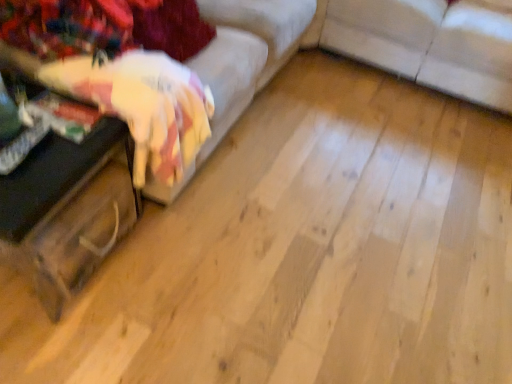
In the scene shown: Measure the distance between point [120,150] and camera.

4.51 feet.

Measure the distance between velvet fabric couch at left, positioned as the first studio couch in left-to-right order, and camera.

velvet fabric couch at left, positioned as the first studio couch in left-to-right order, and camera are 4.26 feet apart.

Where is `white fabric couch at center, placed as the first studio couch when sorted from right to left`? white fabric couch at center, placed as the first studio couch when sorted from right to left is located at coordinates (429, 44).

Is velvet fabric couch at left, positioned as the first studio couch in left-to-right order, turned away from wooden trunk at left?

That's not correct — velvet fabric couch at left, positioned as the first studio couch in left-to-right order, is not looking away from wooden trunk at left.

Is point (249, 36) closer or farther from the camera than point (52, 191)?

Point (249, 36) is farther from the camera than point (52, 191).

From the image's perspective, which is below, velvet fabric couch at left, positioned as the first studio couch in left-to-right order, or wooden trunk at left?

wooden trunk at left appears lower in the image.

From a real-world perspective, who is located higher, white fabric couch at center, placed as the first studio couch when sorted from right to left, or velvet fabric couch at left, which is counted as the second studio couch, starting from the right?

In real-world perspective, velvet fabric couch at left, which is counted as the second studio couch, starting from the right, is above.

Is point (414, 74) positioned in front of point (195, 99)?

That is False.

What's the angular difference between white fabric couch at center, placed as the first studio couch when sorted from right to left, and velvet fabric couch at left, positioned as the first studio couch in left-to-right order,'s facing directions?

The angle between the facing direction of white fabric couch at center, placed as the first studio couch when sorted from right to left, and the facing direction of velvet fabric couch at left, positioned as the first studio couch in left-to-right order, is 90.3 degrees.

Image resolution: width=512 pixels, height=384 pixels. Identify the location of studio couch below the white fabric couch at center, positioned as the 2th studio couch in left-to-right order (from the image's perspective). (182, 83).

Locate an element on the screen. The image size is (512, 384). table behind the velvet fabric couch at left, positioned as the first studio couch in left-to-right order is located at coordinates (67, 210).

Does wooden trunk at left have a greater height compared to velvet fabric couch at left, which is counted as the second studio couch, starting from the right?

Incorrect, the height of wooden trunk at left is not larger of that of velvet fabric couch at left, which is counted as the second studio couch, starting from the right.

Considering the points (132, 194) and (241, 66), which point is in front, point (132, 194) or point (241, 66)?

The point (132, 194) is closer to the camera.

Is wooden trunk at left inside the boundaries of velvet fabric couch at left, positioned as the first studio couch in left-to-right order, or outside?

wooden trunk at left exists outside the volume of velvet fabric couch at left, positioned as the first studio couch in left-to-right order.

Locate an element on the screen. Image resolution: width=512 pixels, height=384 pixels. studio couch on the right of velvet fabric couch at left, which is counted as the second studio couch, starting from the right is located at coordinates (429, 44).

In terms of height, does velvet fabric couch at left, which is counted as the second studio couch, starting from the right, look taller or shorter compared to white fabric couch at center, positioned as the 2th studio couch in left-to-right order?

Considering their sizes, velvet fabric couch at left, which is counted as the second studio couch, starting from the right, has more height than white fabric couch at center, positioned as the 2th studio couch in left-to-right order.

Are velvet fabric couch at left, positioned as the first studio couch in left-to-right order, and white fabric couch at center, positioned as the 2th studio couch in left-to-right order, far apart?

No, velvet fabric couch at left, positioned as the first studio couch in left-to-right order, is not far from white fabric couch at center, positioned as the 2th studio couch in left-to-right order.

From the image's perspective, is velvet fabric couch at left, positioned as the first studio couch in left-to-right order, positioned above or below white fabric couch at center, placed as the first studio couch when sorted from right to left?

Clearly, from the image's perspective, velvet fabric couch at left, positioned as the first studio couch in left-to-right order, is below white fabric couch at center, placed as the first studio couch when sorted from right to left.

The image size is (512, 384). I want to click on studio couch located behind the wooden trunk at left, so click(x=429, y=44).

Can you confirm if wooden trunk at left is thinner than white fabric couch at center, positioned as the 2th studio couch in left-to-right order?

Yes, wooden trunk at left is thinner than white fabric couch at center, positioned as the 2th studio couch in left-to-right order.

Which is more to the left, wooden trunk at left or white fabric couch at center, positioned as the 2th studio couch in left-to-right order?

From the viewer's perspective, wooden trunk at left appears more on the left side.

In the image, is wooden trunk at left positioned in front of or behind white fabric couch at center, placed as the first studio couch when sorted from right to left?

Clearly, wooden trunk at left is in front of white fabric couch at center, placed as the first studio couch when sorted from right to left.

Between white fabric couch at center, positioned as the 2th studio couch in left-to-right order, and wooden trunk at left, which one appears on the left side from the viewer's perspective?

Positioned to the left is wooden trunk at left.

Does white fabric couch at center, positioned as the 2th studio couch in left-to-right order, lie in front of wooden trunk at left?

That is False.

Is white fabric couch at center, positioned as the 2th studio couch in left-to-right order, next to wooden trunk at left and touching it?

No, white fabric couch at center, positioned as the 2th studio couch in left-to-right order, is not touching wooden trunk at left.

Considering the relative sizes of white fabric couch at center, placed as the first studio couch when sorted from right to left, and wooden trunk at left in the image provided, is white fabric couch at center, placed as the first studio couch when sorted from right to left, taller than wooden trunk at left?

Answer: Yes.

You are a GUI agent. You are given a task and a screenshot of the screen. Output one action in this format:
    pyautogui.click(x=<x>, y=<y>)
    Task: Click on the studio couch that is the 2nd one above the wooden trunk at left (from a real-world perspective)
    
    Given the screenshot: What is the action you would take?
    [182, 83]

Image resolution: width=512 pixels, height=384 pixels. Find the location of `studio couch in front of the white fabric couch at center, positioned as the 2th studio couch in left-to-right order`. studio couch in front of the white fabric couch at center, positioned as the 2th studio couch in left-to-right order is located at coordinates (182, 83).

Looking at the image, which one is located closer to white fabric couch at center, positioned as the 2th studio couch in left-to-right order, wooden trunk at left or velvet fabric couch at left, which is counted as the second studio couch, starting from the right?

velvet fabric couch at left, which is counted as the second studio couch, starting from the right, lies closer to white fabric couch at center, positioned as the 2th studio couch in left-to-right order, than the other object.

From the image, which object appears to be nearer to velvet fabric couch at left, which is counted as the second studio couch, starting from the right, white fabric couch at center, positioned as the 2th studio couch in left-to-right order, or wooden trunk at left?

Based on the image, wooden trunk at left appears to be nearer to velvet fabric couch at left, which is counted as the second studio couch, starting from the right.

Estimate the real-world distances between objects in this image. Which object is closer to wooden trunk at left, white fabric couch at center, positioned as the 2th studio couch in left-to-right order, or velvet fabric couch at left, positioned as the first studio couch in left-to-right order?

velvet fabric couch at left, positioned as the first studio couch in left-to-right order.

Looking at the image, which one is located further to velvet fabric couch at left, which is counted as the second studio couch, starting from the right, wooden trunk at left or white fabric couch at center, positioned as the 2th studio couch in left-to-right order?

white fabric couch at center, positioned as the 2th studio couch in left-to-right order, is positioned further to the anchor velvet fabric couch at left, which is counted as the second studio couch, starting from the right.

Estimate the real-world distances between objects in this image. Which object is closer to wooden trunk at left, velvet fabric couch at left, positioned as the first studio couch in left-to-right order, or white fabric couch at center, placed as the first studio couch when sorted from right to left?

velvet fabric couch at left, positioned as the first studio couch in left-to-right order.

When comparing their distances from white fabric couch at center, placed as the first studio couch when sorted from right to left, does velvet fabric couch at left, which is counted as the second studio couch, starting from the right, or wooden trunk at left seem closer?

velvet fabric couch at left, which is counted as the second studio couch, starting from the right, is positioned closer to the anchor white fabric couch at center, placed as the first studio couch when sorted from right to left.

Identify the location of studio couch between wooden trunk at left and white fabric couch at center, positioned as the 2th studio couch in left-to-right order. This screenshot has width=512, height=384. click(x=182, y=83).